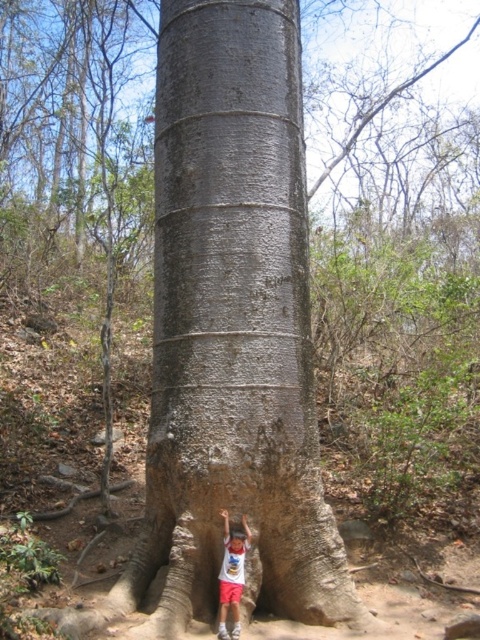
Can you confirm if gray rough bark tree trunk at center is wider than matte white t-shirt at center?

Yes, gray rough bark tree trunk at center is wider than matte white t-shirt at center.

Looking at this image, who is more forward, (182, 209) or (244, 516)?

Point (244, 516) is more forward.

Who is more distant from viewer, (257, 298) or (222, 573)?

The point (257, 298) is more distant.

Identify the location of gray rough bark tree trunk at center. The width and height of the screenshot is (480, 640). (232, 326).